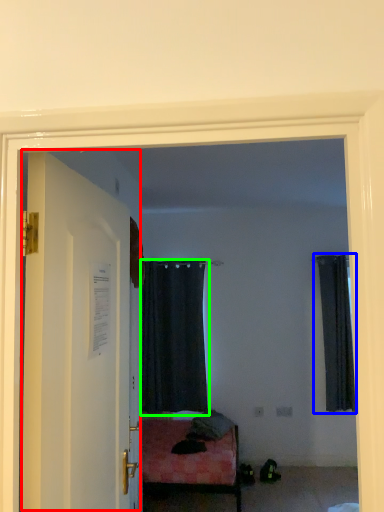
Question: Estimate the real-world distances between objects in this image. Which object is farther from door (highlighted by a red box), curtain (highlighted by a blue box) or curtain (highlighted by a green box)?

Choices:
 (A) curtain
 (B) curtain

Answer: (A)